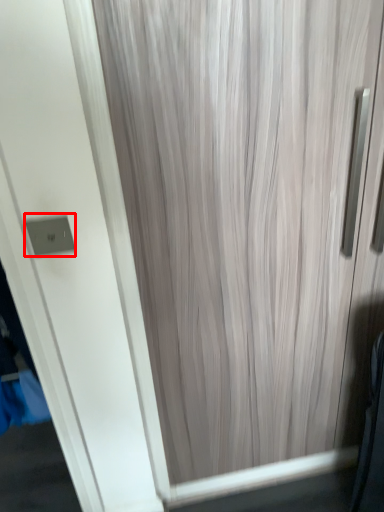
Question: From the image's perspective, where is electric outlet (annotated by the red box) located in relation to curtain in the image?

Choices:
 (A) above
 (B) below

Answer: (A)